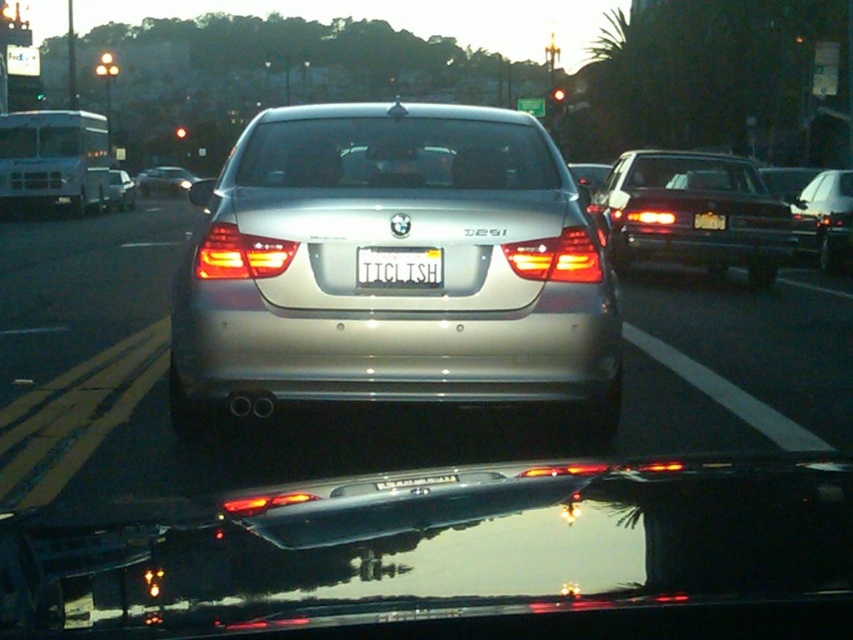
Question: Can you confirm if transparent glass windshield at center is bigger than satin silver sedan at center?

Choices:
 (A) no
 (B) yes

Answer: (A)

Question: Estimate the real-world distances between objects in this image. Which object is closer to the satin silver sedan at center?

Choices:
 (A) satin metallic sedan at center
 (B) white metallic license plate at center
 (C) satin black sedan at right
 (D) satin black sedan at center

Answer: (D)

Question: Which of the following is the farthest from the observer?

Choices:
 (A) satin metallic sedan at center
 (B) transparent glass windshield at center
 (C) red glass traffic light at upper center

Answer: (C)

Question: Is satin black sedan at right positioned behind white metallic license plate at center?

Choices:
 (A) no
 (B) yes

Answer: (B)

Question: Can you confirm if transparent glass windshield at center is thinner than satin silver sedan at center?

Choices:
 (A) yes
 (B) no

Answer: (B)

Question: Which object is the farthest from the white plastic license plate at center?

Choices:
 (A) satin black sedan at right
 (B) satin silver sedan at upper left
 (C) transparent glass windshield at center

Answer: (B)